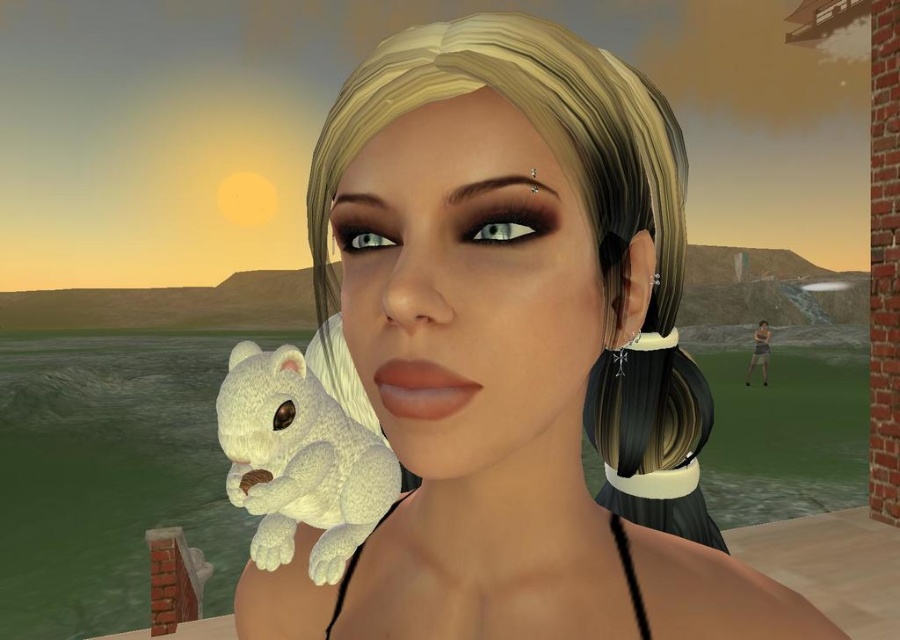
Does white plush bear at center appear on the left side of white plush toy at center?

No, white plush bear at center is not to the left of white plush toy at center.

This screenshot has height=640, width=900. What do you see at coordinates (513, 349) in the screenshot? I see `white plush bear at center` at bounding box center [513, 349].

This screenshot has width=900, height=640. Find the location of `white plush bear at center`. white plush bear at center is located at coordinates (513, 349).